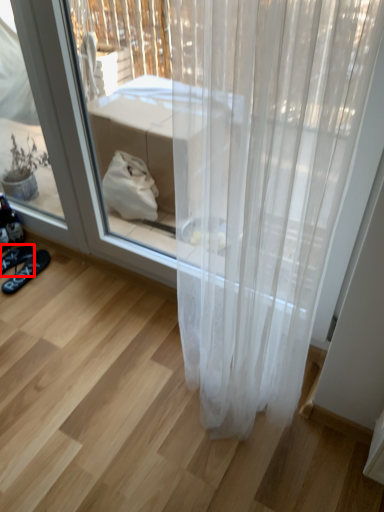
Question: In this image, where is footwear (annotated by the red box) located relative to footwear?

Choices:
 (A) right
 (B) left

Answer: (B)